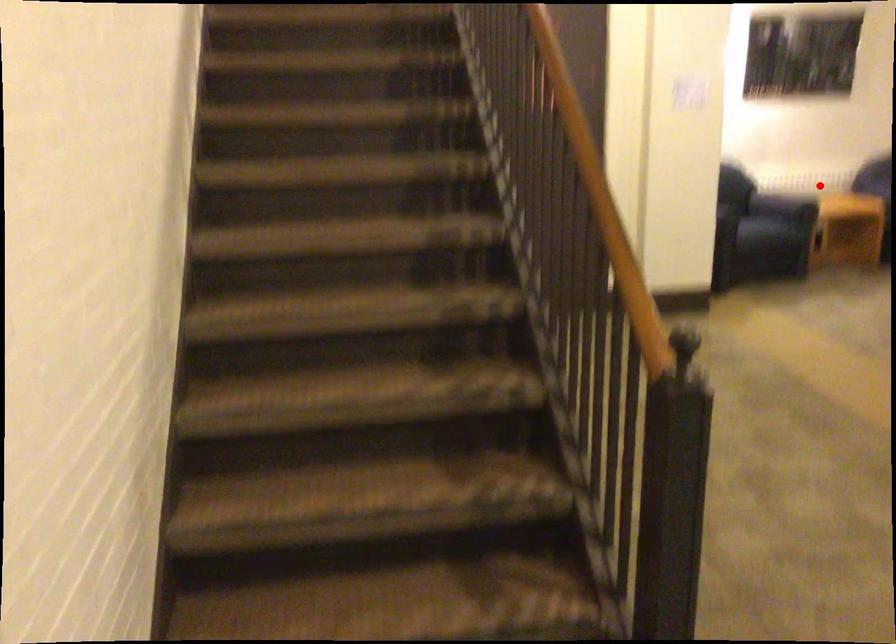
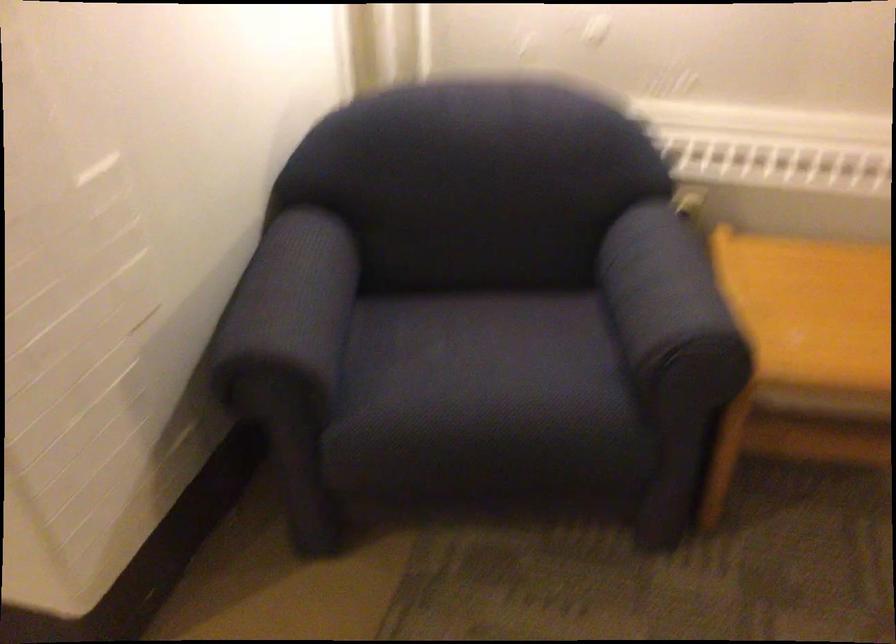
Question: I am providing you with two images of the same scene from different viewpoints. Given a red point in image1, look at the same physical point in image2. Is it:

Choices:
 (A) Closer to the viewpoint
 (B) Farther from the viewpoint

Answer: (A)